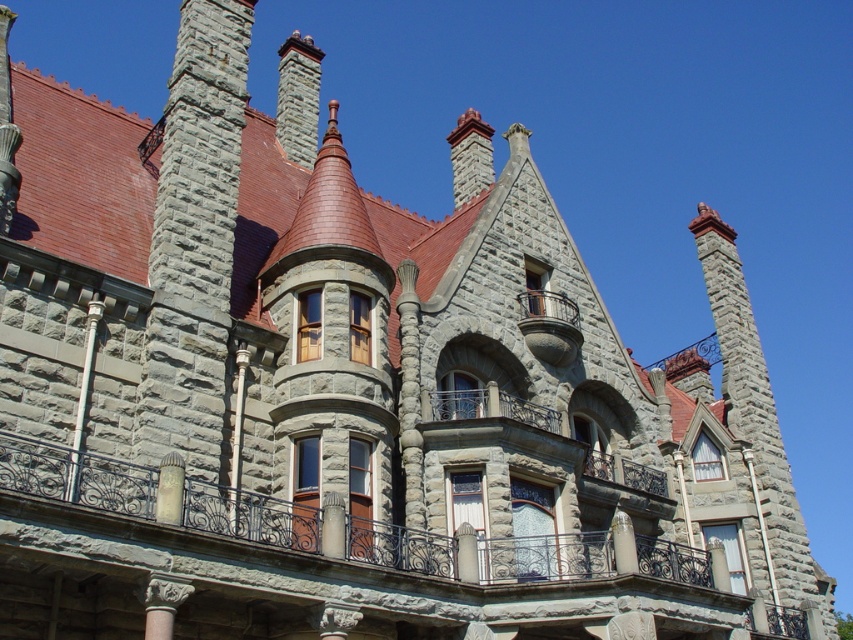
Can you confirm if gray stone chimney at left is smaller than gray stone chimney at upper center?

Yes, gray stone chimney at left is smaller than gray stone chimney at upper center.

Is point (146, 429) farther from viewer compared to point (312, 156)?

No, it is in front of (312, 156).

This screenshot has width=853, height=640. In order to click on gray stone chimney at left in this screenshot , I will do `click(193, 246)`.

Who is higher up, gray stone chimney at right or gray stone chimney at upper center?

gray stone chimney at upper center

Based on the photo, does gray stone chimney at right have a greater height compared to gray stone chimney at upper center?

In fact, gray stone chimney at right may be shorter than gray stone chimney at upper center.

The image size is (853, 640). I want to click on gray stone chimney at right, so click(x=758, y=424).

This screenshot has height=640, width=853. Find the location of `gray stone chimney at right`. gray stone chimney at right is located at coordinates (x=758, y=424).

Consider the image. Is stone balcony at center taller than gray stone chimney at upper center?

In fact, stone balcony at center may be shorter than gray stone chimney at upper center.

Locate an element on the screen. stone balcony at center is located at coordinates (525, 435).

At what (x,y) coordinates should I click in order to perform the action: click on stone balcony at center. Please return your answer as a coordinate pair (x, y). Looking at the image, I should click on (525, 435).